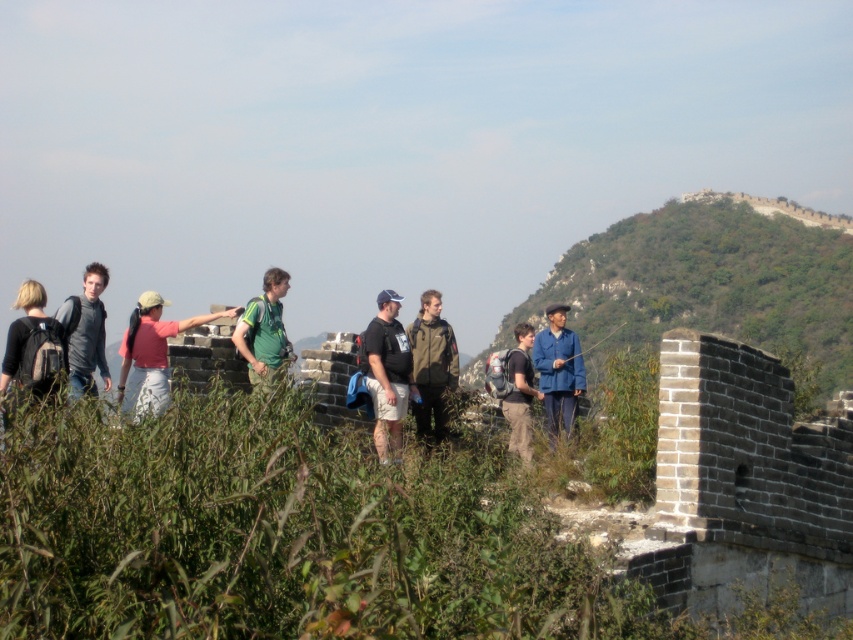
Question: Does green grassy hillside at upper right come in front of matte black t-shirt at center?

Choices:
 (A) yes
 (B) no

Answer: (B)

Question: Which of the following is the closest to the observer?

Choices:
 (A) matte gray shirt at left
 (B) matte black t-shirt at center
 (C) dark gray fabric backpack at center

Answer: (A)

Question: Can you confirm if dark green textured jacket at center is bigger than blue fabric jacket at center?

Choices:
 (A) yes
 (B) no

Answer: (B)

Question: Which of the following is the closest to the observer?

Choices:
 (A) (529, 419)
 (B) (102, 280)

Answer: (A)

Question: Is green grassy hillside at upper right to the left of dark gray fabric backpack at center from the viewer's perspective?

Choices:
 (A) yes
 (B) no

Answer: (B)

Question: Which point appears closest to the camera in this image?

Choices:
 (A) (541, 384)
 (B) (427, 410)
 (C) (706, 209)

Answer: (B)